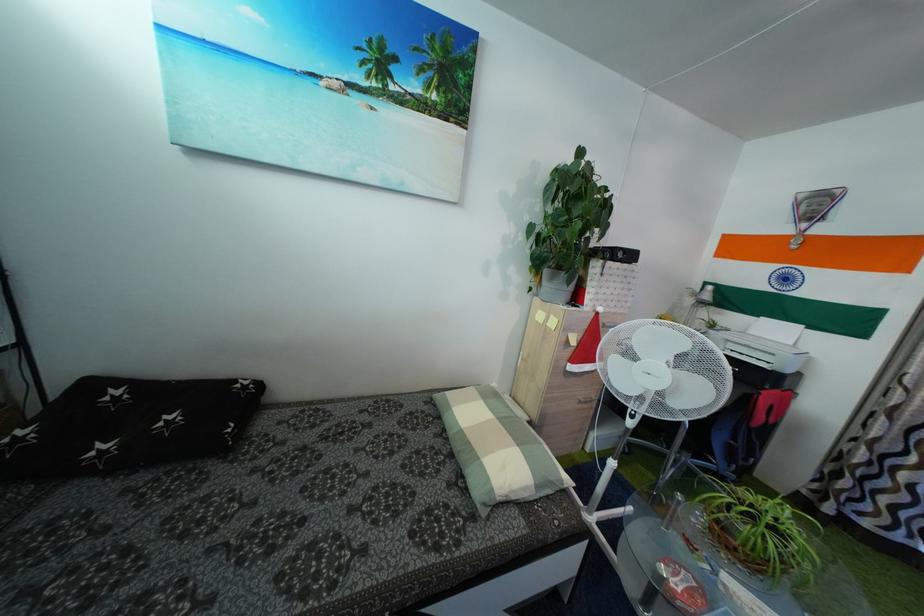
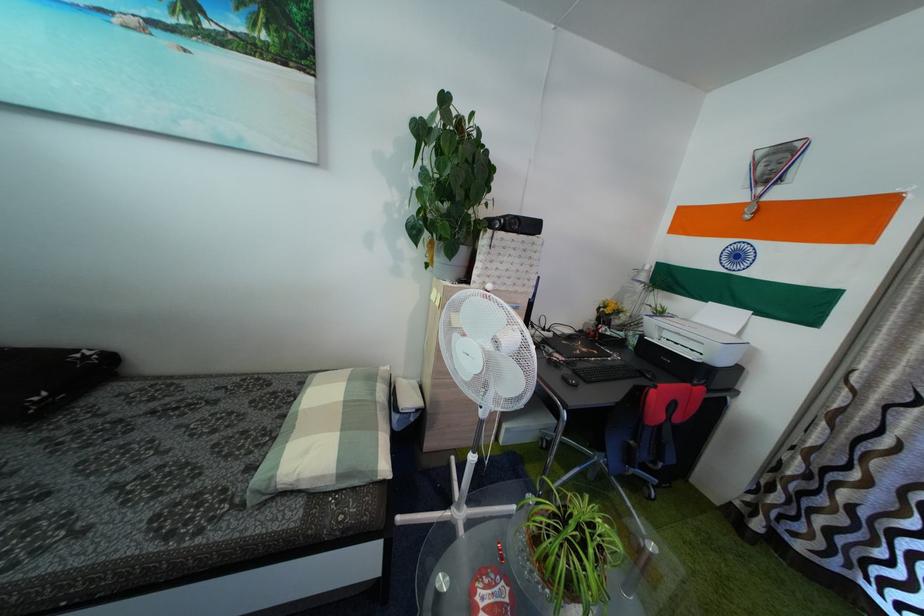
The point at (866, 455) is marked in the first image. Where is the corresponding point in the second image?

(801, 464)